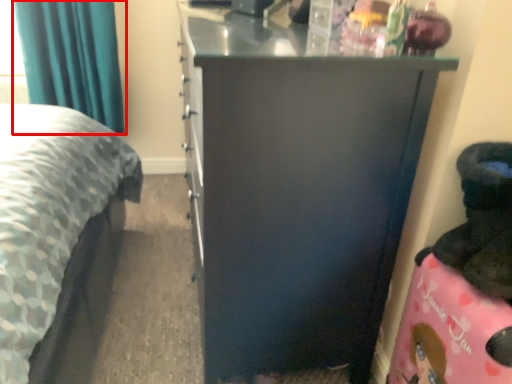
Question: From the image, what is the correct spatial relationship of curtain (annotated by the red box) in relation to furniture?

Choices:
 (A) left
 (B) right

Answer: (A)